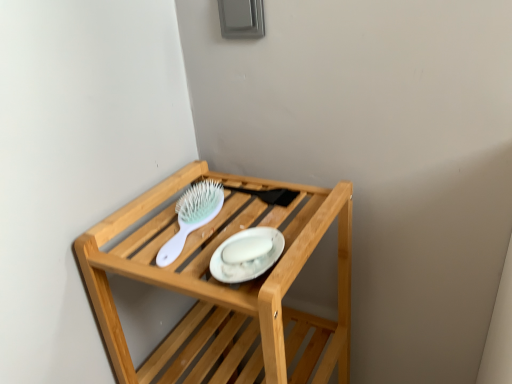
Question: Can you confirm if white glossy platter at center is bigger than white plastic brush at upper center?

Choices:
 (A) yes
 (B) no

Answer: (B)

Question: From the image's perspective, is white glossy platter at center below white plastic brush at upper center?

Choices:
 (A) no
 (B) yes

Answer: (B)

Question: Does white glossy platter at center have a greater width compared to white plastic brush at upper center?

Choices:
 (A) no
 (B) yes

Answer: (A)

Question: Considering the relative sizes of white glossy platter at center and white plastic brush at upper center in the image provided, is white glossy platter at center thinner than white plastic brush at upper center?

Choices:
 (A) yes
 (B) no

Answer: (A)

Question: Is white glossy platter at center looking in the opposite direction of white plastic brush at upper center?

Choices:
 (A) yes
 (B) no

Answer: (B)

Question: Looking at the image, does wooden shelf at upper center seem bigger or smaller compared to white glossy platter at center?

Choices:
 (A) small
 (B) big

Answer: (B)

Question: Is point (279, 369) closer or farther from the camera than point (262, 244)?

Choices:
 (A) closer
 (B) farther

Answer: (A)

Question: Is wooden shelf at upper center situated inside white glossy platter at center or outside?

Choices:
 (A) outside
 (B) inside

Answer: (A)

Question: From a real-world perspective, is wooden shelf at upper center positioned above or below white glossy platter at center?

Choices:
 (A) above
 (B) below

Answer: (B)

Question: Which is correct: white glossy platter at center is inside wooden shelf at upper center, or outside of it?

Choices:
 (A) outside
 (B) inside

Answer: (B)

Question: Considering the positions of white glossy platter at center and wooden shelf at upper center in the image, is white glossy platter at center taller or shorter than wooden shelf at upper center?

Choices:
 (A) short
 (B) tall

Answer: (A)

Question: From a real-world perspective, is white glossy platter at center above or below wooden shelf at upper center?

Choices:
 (A) above
 (B) below

Answer: (A)

Question: From the image's perspective, is white glossy platter at center located above or below wooden shelf at upper center?

Choices:
 (A) below
 (B) above

Answer: (B)

Question: From a real-world perspective, relative to white plastic brush at upper center, is wooden shelf at upper center vertically above or below?

Choices:
 (A) below
 (B) above

Answer: (A)

Question: Considering the positions of wooden shelf at upper center and white plastic brush at upper center in the image, is wooden shelf at upper center bigger or smaller than white plastic brush at upper center?

Choices:
 (A) small
 (B) big

Answer: (B)